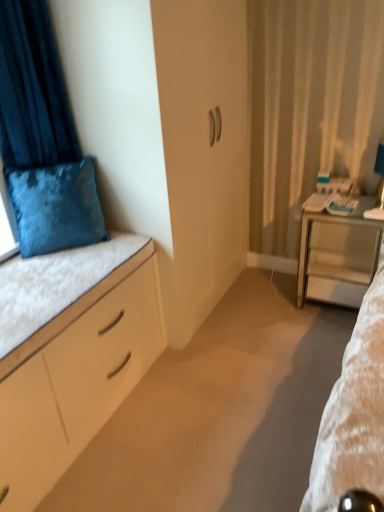
Identify the location of velvet blue cushion at upper left. (32, 91).

Where is `velvet blue pillow at upper left`? velvet blue pillow at upper left is located at coordinates (56, 207).

Locate an element on the screen. The height and width of the screenshot is (512, 384). white glossy bed at left is located at coordinates (76, 377).

Does velvet blue pillow at upper left have a lesser width compared to velvet blue cushion at upper left?

No.

Image resolution: width=384 pixels, height=512 pixels. What are the coordinates of `curtain above the velvet blue pillow at upper left (from a real-world perspective)` in the screenshot? It's located at (32, 91).

Based on the photo, how many degrees apart are the facing directions of velvet blue pillow at upper left and velvet blue cushion at upper left?

The angular difference between velvet blue pillow at upper left and velvet blue cushion at upper left is 33.6 degrees.

Which is closer, (104, 226) or (0, 113)?

Point (0, 113)

Where is `pillow to the right of white glossy bed at left`? The image size is (384, 512). pillow to the right of white glossy bed at left is located at coordinates (56, 207).

Considering the positions of points (73, 192) and (41, 437), is point (73, 192) farther from camera compared to point (41, 437)?

That is True.

Measure the distance from velvet blue pillow at upper left to white glossy bed at left.

The distance of velvet blue pillow at upper left from white glossy bed at left is 18.36 inches.

Based on the photo, from the image's perspective, is velvet blue pillow at upper left above or below white glossy bed at left?

Based on their image positions, velvet blue pillow at upper left is located above white glossy bed at left.

Is velvet blue cushion at upper left facing away from white matte cushion at left?

No, velvet blue cushion at upper left's orientation is not away from white matte cushion at left.

Between velvet blue cushion at upper left and white matte cushion at left, which one has larger width?

white matte cushion at left.

Is point (17, 42) more distant than point (50, 254)?

No, (17, 42) is closer to viewer.

Is velvet blue cushion at upper left in contact with white matte cushion at left?

No, velvet blue cushion at upper left is not in contact with white matte cushion at left.

Are velvet blue pillow at upper left and matte white table lamp at right making contact?

No.

Between point (10, 191) and point (376, 157), which one is positioned in front?

The point (10, 191) is more forward.

Measure the distance between velvet blue pillow at upper left and matte white table lamp at right.

velvet blue pillow at upper left and matte white table lamp at right are 5.07 feet apart from each other.

Based on the photo, how much distance is there between metallic silver desk at right and matte white table lamp at right?

A distance of 9.96 inches exists between metallic silver desk at right and matte white table lamp at right.

Which is behind, metallic silver desk at right or matte white table lamp at right?

matte white table lamp at right.

Identify the location of table lamp above the metallic silver desk at right (from a real-world perspective). (378, 186).

Which is more to the right, metallic silver desk at right or matte white table lamp at right?

From the viewer's perspective, matte white table lamp at right appears more on the right side.

Can you confirm if white matte cushion at left is smaller than matte white table lamp at right?

No, white matte cushion at left is not smaller than matte white table lamp at right.

Is white matte cushion at left touching matte white table lamp at right?

white matte cushion at left and matte white table lamp at right are not in contact.

From the image's perspective, which is above, white matte cushion at left or matte white table lamp at right?

matte white table lamp at right is shown above in the image.

How many degrees apart are the facing directions of white matte cushion at left and matte white table lamp at right?

90.2 degrees.

Is matte white table lamp at right positioned with its back to white matte cushion at left?

No, matte white table lamp at right's orientation is not away from white matte cushion at left.

Does matte white table lamp at right have a greater height compared to white matte cushion at left?

Correct, matte white table lamp at right is much taller as white matte cushion at left.

Is matte white table lamp at right wider than white matte cushion at left?

No, matte white table lamp at right is not wider than white matte cushion at left.

From a real-world perspective, is matte white table lamp at right on white matte cushion at left?

Correct, in the physical world, matte white table lamp at right is higher than white matte cushion at left.

The width and height of the screenshot is (384, 512). In order to click on curtain in front of the velvet blue pillow at upper left in this screenshot , I will do `click(32, 91)`.

Locate an element on the screen. The image size is (384, 512). pillow located above the white glossy bed at left (from the image's perspective) is located at coordinates (56, 207).

Which object lies nearer to the anchor point white glossy bed at left, white matte cushion at left or velvet blue pillow at upper left?

white matte cushion at left lies closer to white glossy bed at left than the other object.

Considering their positions, is velvet blue cushion at upper left positioned further to metallic silver desk at right than white matte cushion at left?

velvet blue cushion at upper left lies further to metallic silver desk at right than the other object.

Based on their spatial positions, is velvet blue cushion at upper left or white glossy bed at left closer to velvet blue pillow at upper left?

The object closer to velvet blue pillow at upper left is velvet blue cushion at upper left.

Estimate the real-world distances between objects in this image. Which object is closer to velvet blue pillow at upper left, white glossy bed at left or matte white table lamp at right?

white glossy bed at left.

From the picture: Looking at the image, which one is located closer to matte white table lamp at right, white glossy bed at left or white matte cushion at left?

Among the two, white glossy bed at left is located nearer to matte white table lamp at right.

Looking at the image, which one is located further to matte white table lamp at right, white glossy bed at left or metallic silver desk at right?

white glossy bed at left is further to matte white table lamp at right.

Estimate the real-world distances between objects in this image. Which object is further from velvet blue pillow at upper left, metallic silver desk at right or white glossy bed at left?

The object further to velvet blue pillow at upper left is metallic silver desk at right.

Based on their spatial positions, is white glossy bed at left or white matte cushion at left closer to velvet blue cushion at upper left?

white matte cushion at left is positioned closer to the anchor velvet blue cushion at upper left.

Where is `ledge between velvet blue cushion at upper left and matte white table lamp at right`? This screenshot has width=384, height=512. ledge between velvet blue cushion at upper left and matte white table lamp at right is located at coordinates (54, 284).

The image size is (384, 512). Identify the location of pillow between white matte cushion at left and matte white table lamp at right. (56, 207).

Find the location of `ledge between velvet blue cushion at upper left and metallic silver desk at right`. ledge between velvet blue cushion at upper left and metallic silver desk at right is located at coordinates (54, 284).

Where is `pillow between velvet blue cushion at upper left and matte white table lamp at right in the horizontal direction`? Image resolution: width=384 pixels, height=512 pixels. pillow between velvet blue cushion at upper left and matte white table lamp at right in the horizontal direction is located at coordinates (56, 207).